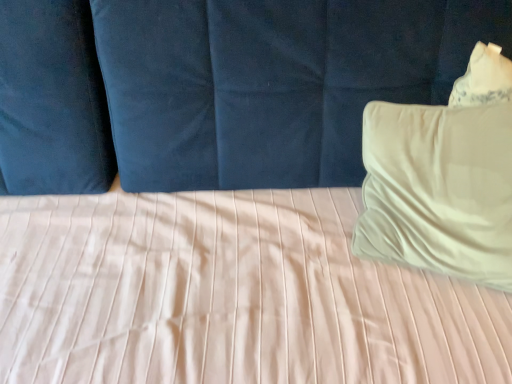
Question: In terms of height, does beige soft pillow at right look taller or shorter compared to matte blue curtain at upper center?

Choices:
 (A) tall
 (B) short

Answer: (B)

Question: Relative to matte blue curtain at upper center, is beige soft pillow at right in front or behind?

Choices:
 (A) front
 (B) behind

Answer: (B)

Question: From a real-world perspective, relative to matte blue curtain at upper center, is beige soft pillow at right vertically above or below?

Choices:
 (A) above
 (B) below

Answer: (A)

Question: Would you say matte blue curtain at upper center is to the left or to the right of beige soft pillow at right in the picture?

Choices:
 (A) left
 (B) right

Answer: (A)

Question: Is matte blue curtain at upper center wider or thinner than beige soft pillow at right?

Choices:
 (A) wide
 (B) thin

Answer: (A)

Question: From a real-world perspective, is matte blue curtain at upper center positioned above or below beige soft pillow at right?

Choices:
 (A) below
 (B) above

Answer: (A)

Question: In terms of size, does matte blue curtain at upper center appear bigger or smaller than beige soft pillow at right?

Choices:
 (A) big
 (B) small

Answer: (A)